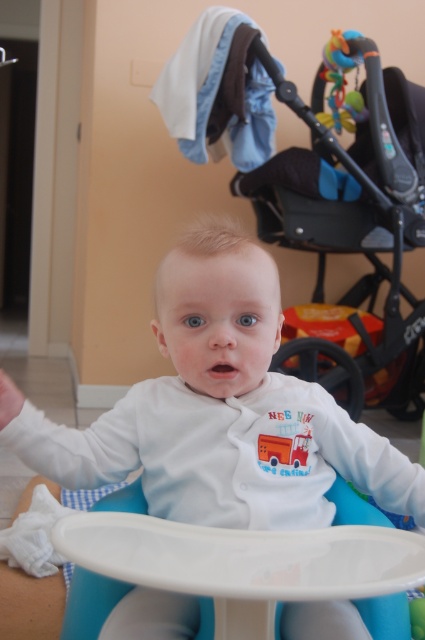
Question: Is black plastic baby carriage at upper center positioned at the back of rubberized plastic teething toy at upper right?

Choices:
 (A) yes
 (B) no

Answer: (B)

Question: Does white plastic table at center appear under rubberized plastic teething toy at upper right?

Choices:
 (A) no
 (B) yes

Answer: (B)

Question: Among these objects, which one is farthest from the camera?

Choices:
 (A) black plastic baby carriage at upper center
 (B) rubberized plastic teething toy at upper right
 (C) white plastic table at center
 (D) white soft baby at center

Answer: (B)

Question: Which of these objects is positioned closest to the white soft baby at center?

Choices:
 (A) black plastic baby carriage at upper center
 (B) rubberized plastic teething toy at upper right

Answer: (A)

Question: In this image, where is black plastic baby carriage at upper center located relative to rubberized plastic teething toy at upper right?

Choices:
 (A) left
 (B) right

Answer: (B)

Question: Estimate the real-world distances between objects in this image. Which object is closer to the rubberized plastic teething toy at upper right?

Choices:
 (A) white plastic table at center
 (B) white soft baby at center
 (C) black plastic baby carriage at upper center

Answer: (C)